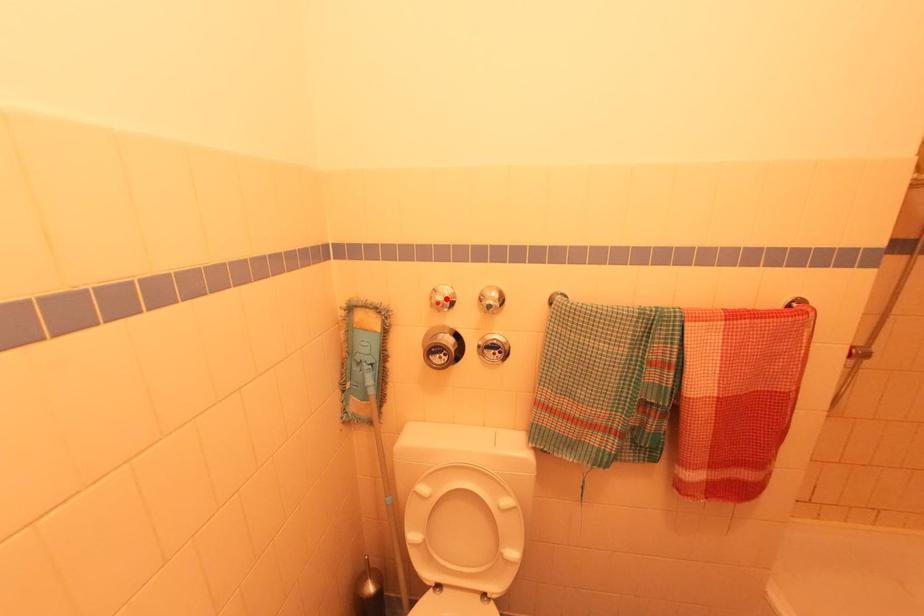
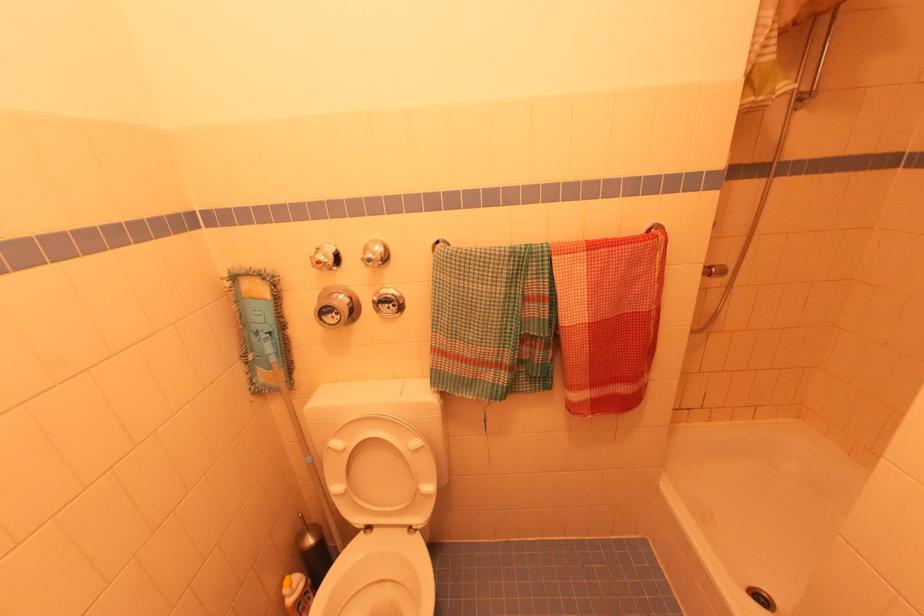
The point at the highlighted location is marked in the first image. Where is the corresponding point in the second image?

(327, 257)